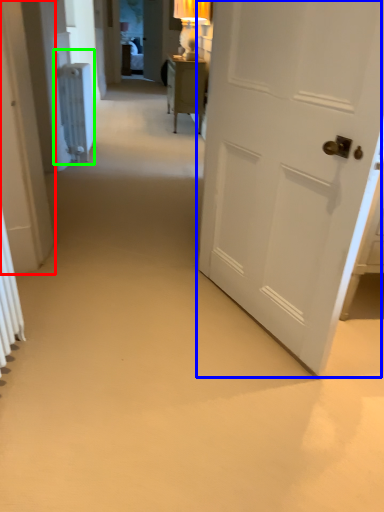
Question: Which object is positioned closest to door (highlighted by a red box)? Select from door (highlighted by a blue box) and radiator (highlighted by a green box).

Choices:
 (A) door
 (B) radiator

Answer: (A)